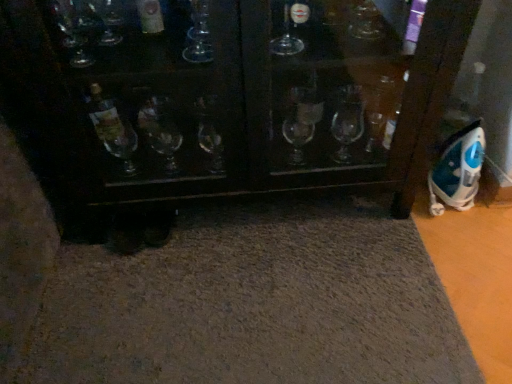
Question: Considering the relative sizes of blue plastic iron at right and gray carpet at lower center in the image provided, is blue plastic iron at right shorter than gray carpet at lower center?

Choices:
 (A) yes
 (B) no

Answer: (B)

Question: From a real-world perspective, is blue plastic iron at right over gray carpet at lower center?

Choices:
 (A) yes
 (B) no

Answer: (A)

Question: Is gray carpet at lower center surrounded by blue plastic iron at right?

Choices:
 (A) yes
 (B) no

Answer: (B)

Question: Is blue plastic iron at right wider than gray carpet at lower center?

Choices:
 (A) no
 (B) yes

Answer: (A)

Question: From the image's perspective, would you say blue plastic iron at right is shown under gray carpet at lower center?

Choices:
 (A) yes
 (B) no

Answer: (B)

Question: Does blue plastic iron at right come behind gray carpet at lower center?

Choices:
 (A) yes
 (B) no

Answer: (A)

Question: From the image's perspective, is gray carpet at lower center above blue plastic iron at right?

Choices:
 (A) no
 (B) yes

Answer: (A)

Question: Does gray carpet at lower center have a lesser width compared to blue plastic iron at right?

Choices:
 (A) no
 (B) yes

Answer: (A)

Question: Considering the relative sizes of gray carpet at lower center and blue plastic iron at right in the image provided, is gray carpet at lower center bigger than blue plastic iron at right?

Choices:
 (A) yes
 (B) no

Answer: (A)

Question: Does gray carpet at lower center appear on the left side of blue plastic iron at right?

Choices:
 (A) yes
 (B) no

Answer: (A)

Question: From the image's perspective, is gray carpet at lower center located beneath blue plastic iron at right?

Choices:
 (A) no
 (B) yes

Answer: (B)

Question: Can you confirm if gray carpet at lower center is smaller than blue plastic iron at right?

Choices:
 (A) no
 (B) yes

Answer: (A)

Question: Does point (423, 362) appear closer or farther from the camera than point (455, 165)?

Choices:
 (A) closer
 (B) farther

Answer: (A)